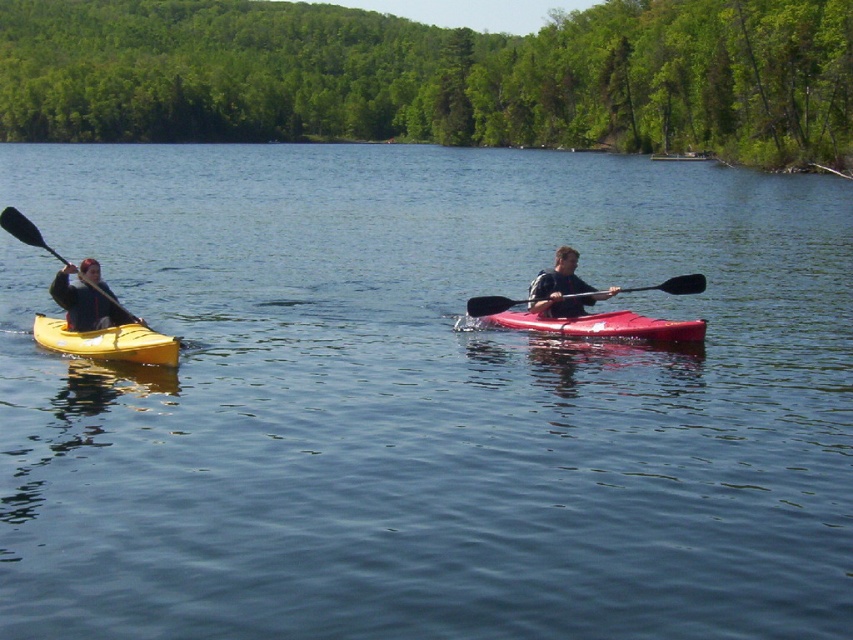
You are a photographer trying to capture the matte yellow kayak at left in your shot. The camera is positioned at point A, which is at coordinates 0.5, 0.1. The focus point of your camera is set to point B at [107,340]. Is the matte yellow kayak at left in focus?

Yes, the focus point at point B at [107,340] marks the location of the matte yellow kayak at left, so the kayak is in focus.